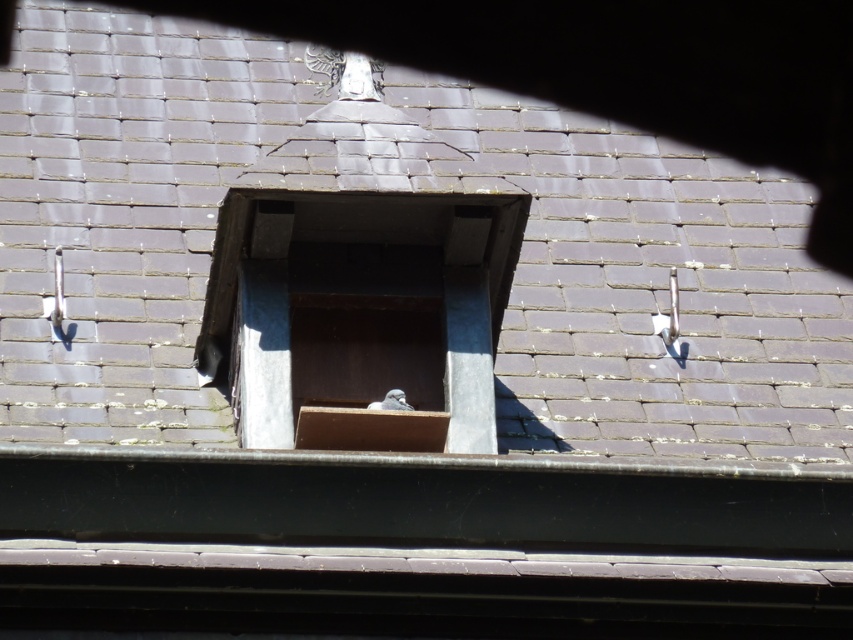
Can you confirm if wooden box at center is wider than white feathered bird at center?

Incorrect, wooden box at center's width does not surpass white feathered bird at center's.

Measure the distance between point (248, 371) and camera.

Point (248, 371) is 41.65 meters away from camera.

This screenshot has height=640, width=853. Find the location of `wooden box at center`. wooden box at center is located at coordinates (358, 316).

Does smooth slate roof at center appear on the right side of white feathered bird at center?

Yes, smooth slate roof at center is to the right of white feathered bird at center.

Can you confirm if smooth slate roof at center is positioned below white feathered bird at center?

Actually, smooth slate roof at center is above white feathered bird at center.

Between point (575, 444) and point (392, 408), which one is positioned behind?

The point (575, 444) is more distant.

Locate an element on the screen. smooth slate roof at center is located at coordinates (384, 262).

Does smooth slate roof at center come in front of wooden box at center?

That is True.

This screenshot has width=853, height=640. Describe the element at coordinates (384, 262) in the screenshot. I see `smooth slate roof at center` at that location.

At what (x,y) coordinates should I click in order to perform the action: click on smooth slate roof at center. Please return your answer as a coordinate pair (x, y). Looking at the image, I should click on (384, 262).